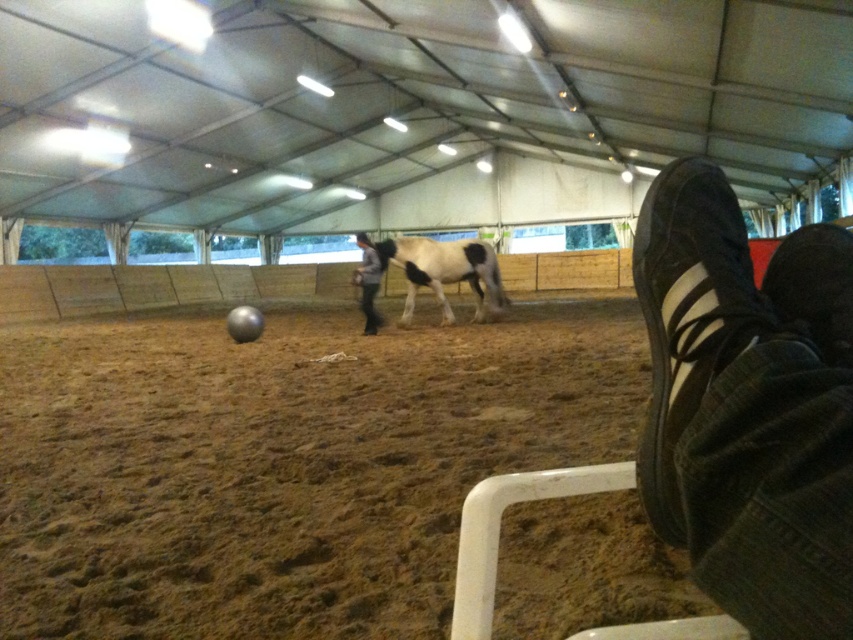
Question: Which point is closer to the camera?

Choices:
 (A) light gray fabric pants at center
 (B) white and black speckled horse at center

Answer: (A)

Question: Is white and black speckled horse at center positioned in front of light gray fabric pants at center?

Choices:
 (A) yes
 (B) no

Answer: (B)

Question: In this image, where is black suede shoe at lower right located relative to light gray fabric pants at center?

Choices:
 (A) right
 (B) left

Answer: (A)

Question: Which object is positioned closest to the light gray fabric pants at center?

Choices:
 (A) white and black speckled horse at center
 (B) black suede shoe at lower right

Answer: (A)

Question: Can you confirm if black suede shoe at lower right is bigger than light gray fabric pants at center?

Choices:
 (A) no
 (B) yes

Answer: (A)

Question: Which point is closer to the camera?

Choices:
 (A) (381, 321)
 (B) (476, 305)

Answer: (A)